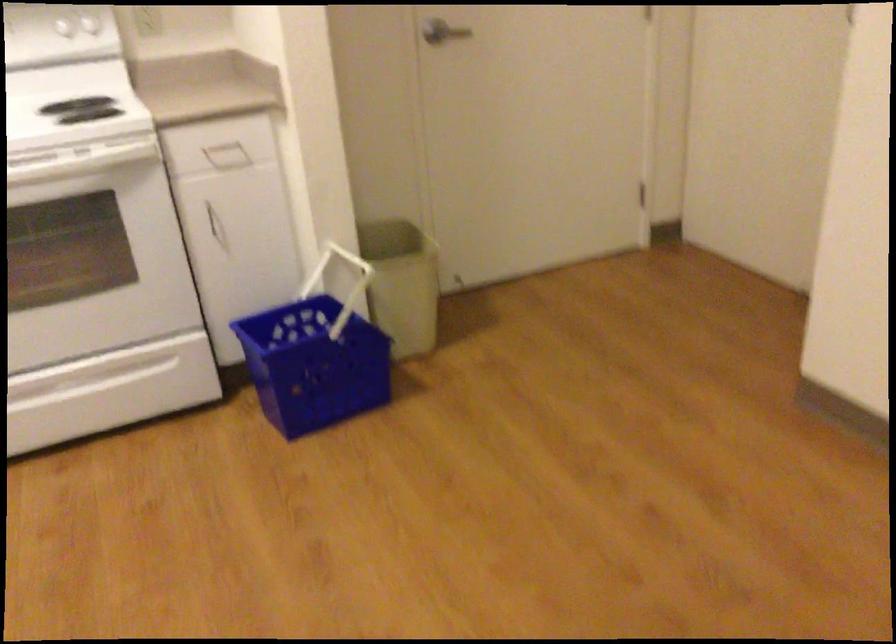
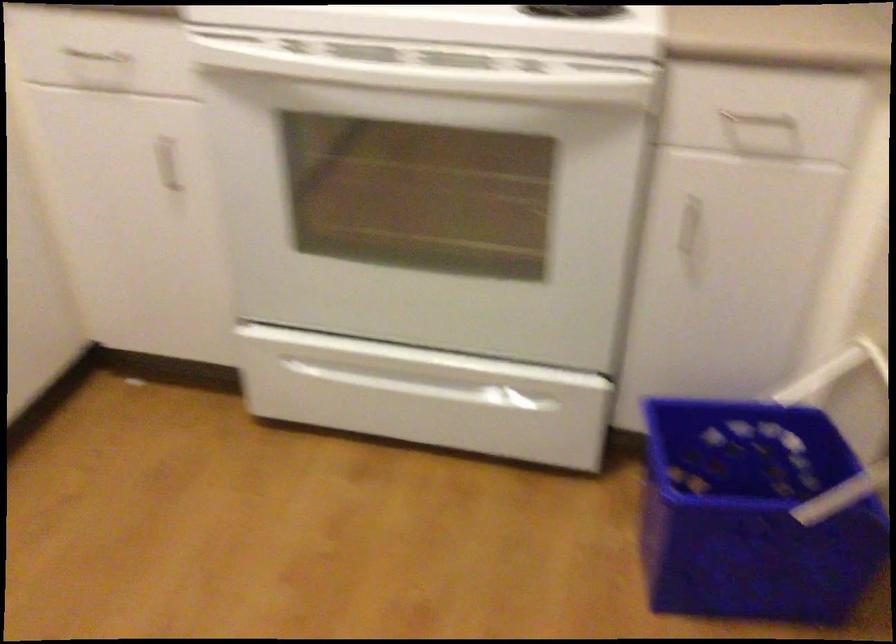
In the second image, find the point that corresponds to the point at 314,348 in the first image.

(752, 514)